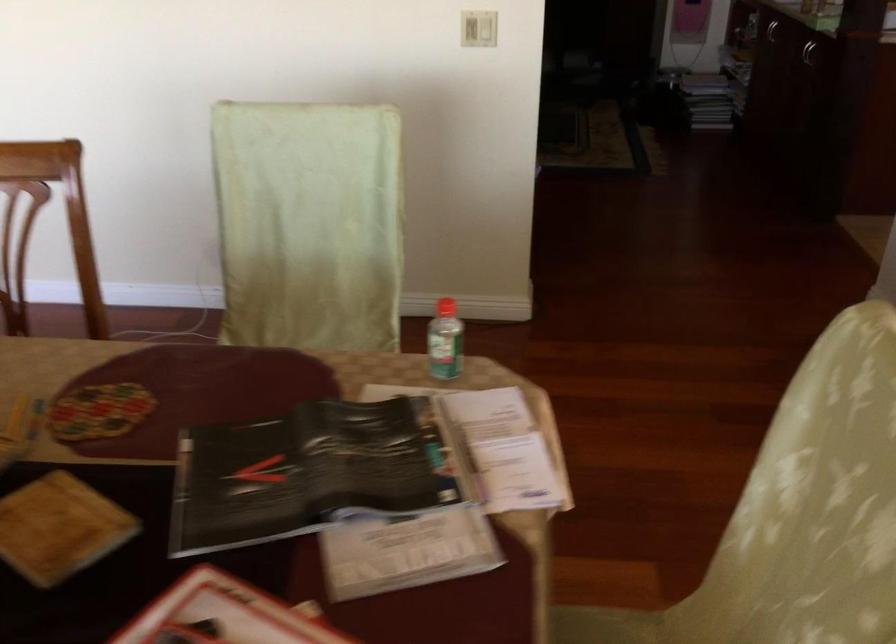
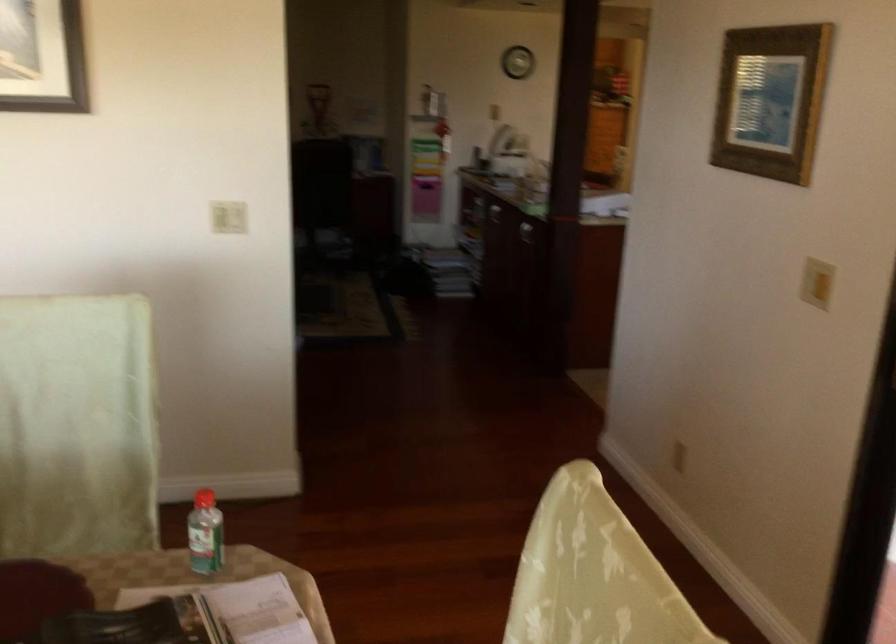
Question: How did the camera likely rotate?

Choices:
 (A) Left
 (B) Right
 (C) Up
 (D) Down

Answer: (B)